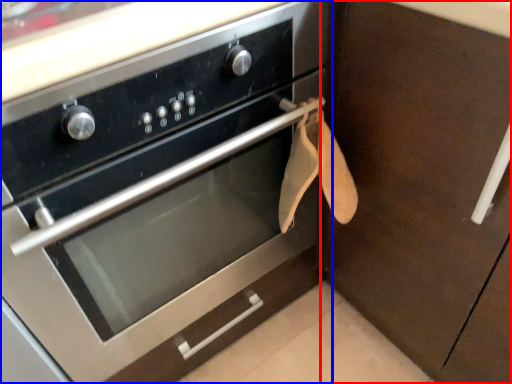
Question: Which of the following is the closest to the observer, cabinetry (highlighted by a red box) or oven (highlighted by a blue box)?

Choices:
 (A) cabinetry
 (B) oven

Answer: (B)